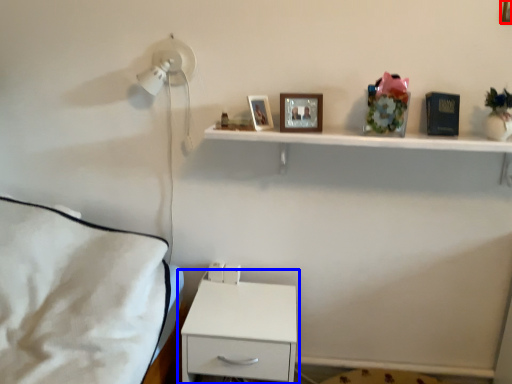
Question: Which of the following is the farthest to the observer, picture frame (highlighted by a red box) or nightstand (highlighted by a blue box)?

Choices:
 (A) picture frame
 (B) nightstand

Answer: (B)